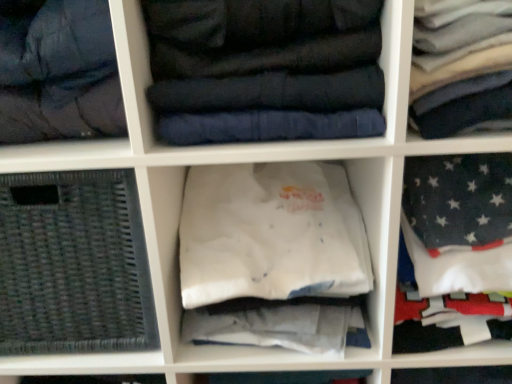
Question: Which direction should I rotate to look at white cotton t-shirt at center, which is the second clothing in right-to-left order, — up or down?

Choices:
 (A) down
 (B) up

Answer: (A)

Question: Considering the relative sizes of black woven basket at lower left and dark blue quilted jacket at center, acting as the third clothing starting from the right, in the image provided, is black woven basket at lower left smaller than dark blue quilted jacket at center, acting as the third clothing starting from the right,?

Choices:
 (A) yes
 (B) no

Answer: (B)

Question: Is black woven basket at lower left with dark blue quilted jacket at center, marked as the 1th clothing in a left-to-right arrangement?

Choices:
 (A) yes
 (B) no

Answer: (B)

Question: Considering the relative positions of black woven basket at lower left and dark blue quilted jacket at center, acting as the third clothing starting from the right, in the image provided, is black woven basket at lower left in front of dark blue quilted jacket at center, acting as the third clothing starting from the right,?

Choices:
 (A) yes
 (B) no

Answer: (B)

Question: Is dark blue quilted jacket at center, acting as the third clothing starting from the right, a part of black woven basket at lower left?

Choices:
 (A) yes
 (B) no

Answer: (B)

Question: Would you say black woven basket at lower left is a long distance from dark blue quilted jacket at center, acting as the third clothing starting from the right?

Choices:
 (A) yes
 (B) no

Answer: (B)

Question: Considering the relative positions of black woven basket at lower left and dark blue quilted jacket at center, marked as the 1th clothing in a left-to-right arrangement, in the image provided, is black woven basket at lower left to the right of dark blue quilted jacket at center, marked as the 1th clothing in a left-to-right arrangement, from the viewer's perspective?

Choices:
 (A) no
 (B) yes

Answer: (A)

Question: From a real-world perspective, is dark gray quilted jacket at upper left beneath dark blue quilted jacket at center, acting as the third clothing starting from the right?

Choices:
 (A) yes
 (B) no

Answer: (B)

Question: Can you confirm if dark gray quilted jacket at upper left is wider than dark blue quilted jacket at center, marked as the 1th clothing in a left-to-right arrangement?

Choices:
 (A) no
 (B) yes

Answer: (A)

Question: Is dark gray quilted jacket at upper left not near dark blue quilted jacket at center, marked as the 1th clothing in a left-to-right arrangement?

Choices:
 (A) yes
 (B) no

Answer: (B)

Question: Is dark gray quilted jacket at upper left facing away from dark blue quilted jacket at center, acting as the third clothing starting from the right?

Choices:
 (A) no
 (B) yes

Answer: (A)

Question: Considering the relative sizes of dark gray quilted jacket at upper left and dark blue quilted jacket at center, marked as the 1th clothing in a left-to-right arrangement, in the image provided, is dark gray quilted jacket at upper left smaller than dark blue quilted jacket at center, marked as the 1th clothing in a left-to-right arrangement,?

Choices:
 (A) no
 (B) yes

Answer: (B)

Question: From the image's perspective, would you say dark gray quilted jacket at upper left is shown under dark blue quilted jacket at center, acting as the third clothing starting from the right?

Choices:
 (A) no
 (B) yes

Answer: (B)

Question: Is dark gray quilted jacket at upper left far from black woven basket at lower left?

Choices:
 (A) yes
 (B) no

Answer: (B)